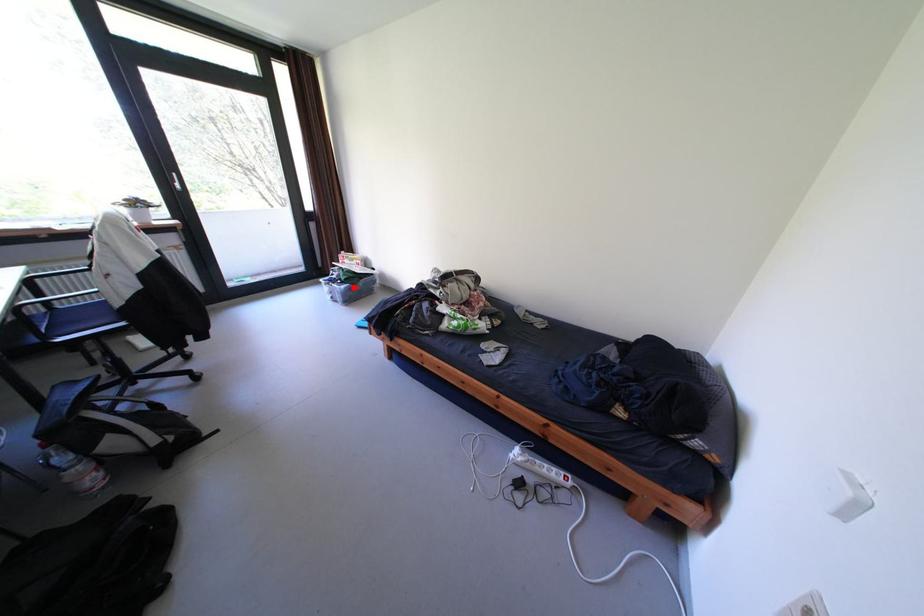
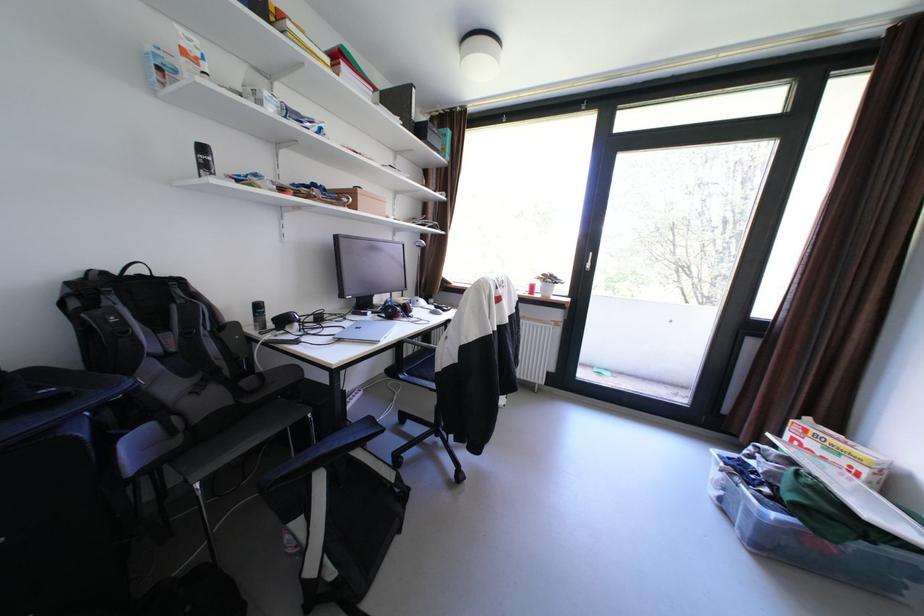
Question: I am providing you with two images of the same scene from different viewpoints. A red point is shown in image1. For the corresponding object point in image2, is it positioned nearer or farther from the camera?

Choices:
 (A) Nearer
 (B) Farther

Answer: (A)